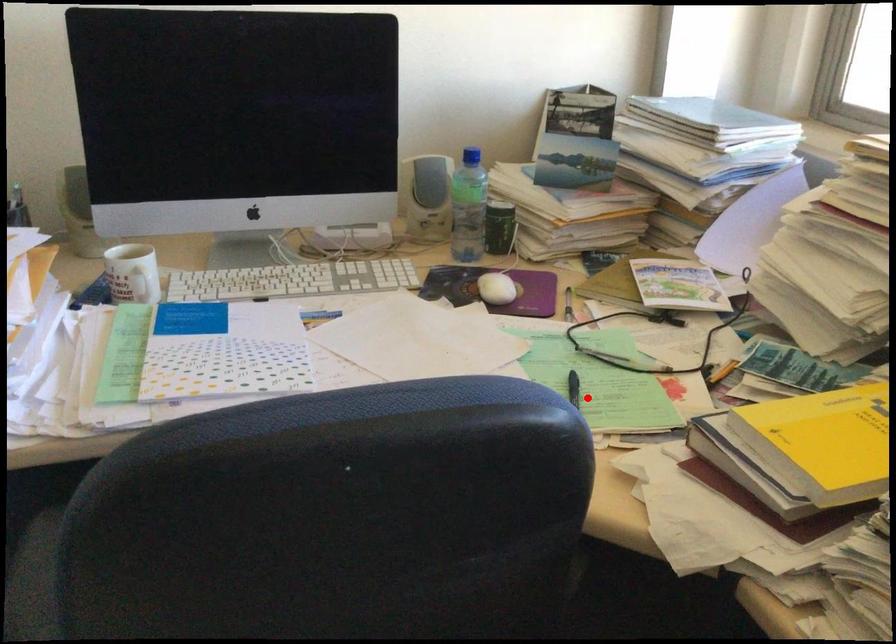
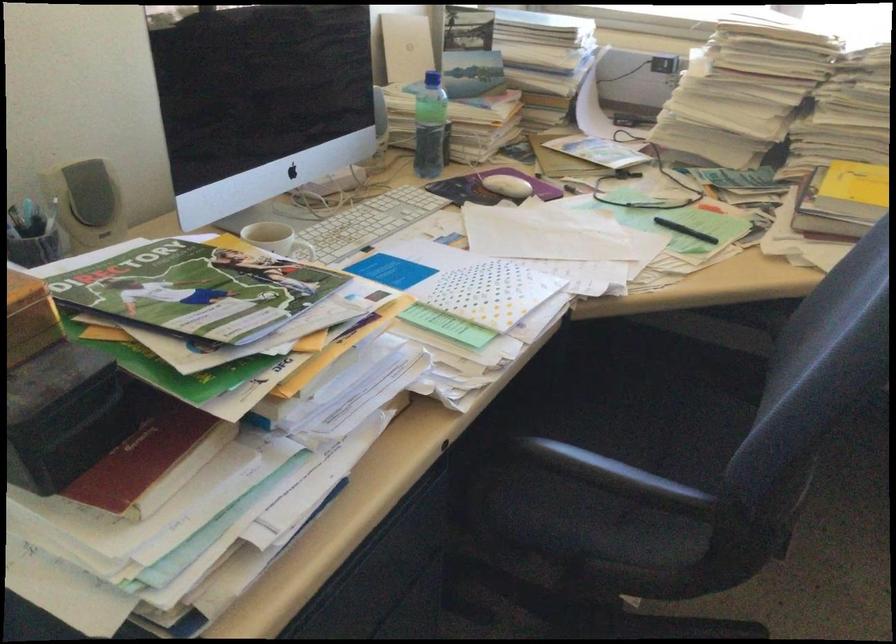
In the second image, find the point that corresponds to the highlighted location in the first image.

(684, 230)